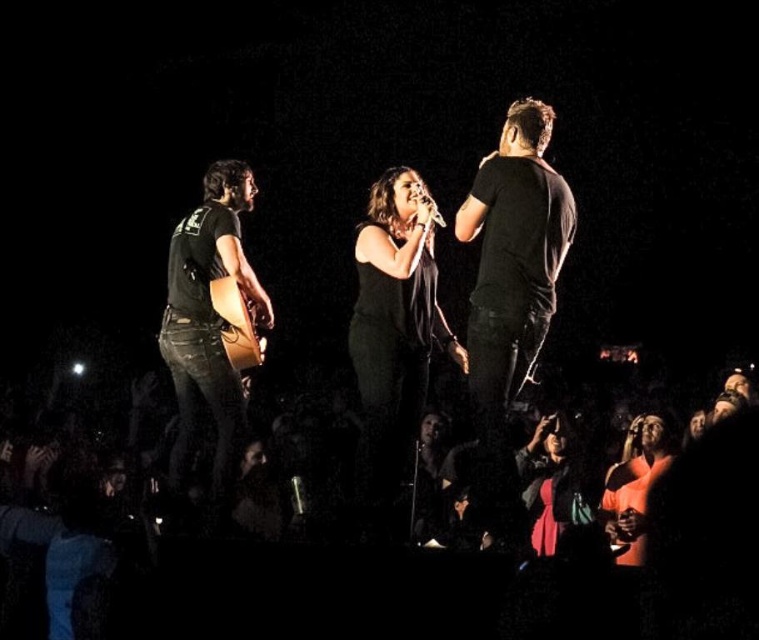
Question: Where is black matte dress at center located in relation to black leather guitar at left in the image?

Choices:
 (A) left
 (B) right

Answer: (B)

Question: Can you confirm if black matte dress at center is positioned to the left of metallic silver microphone at center?

Choices:
 (A) yes
 (B) no

Answer: (A)

Question: Which object appears farthest from the camera in this image?

Choices:
 (A) black matte shirt at center
 (B) brown wooden guitar at center

Answer: (B)

Question: Among these points, which one is nearest to the camera?

Choices:
 (A) (717, 454)
 (B) (424, 192)
 (C) (534, 484)
 (D) (367, 300)

Answer: (A)

Question: Can you confirm if black matte dress at center is wider than brown wooden guitar at center?

Choices:
 (A) no
 (B) yes

Answer: (B)

Question: Based on their relative distances, which object is farther from the black leather guitar at left?

Choices:
 (A) black matte dress at center
 (B) black matte shirt at center
 (C) metallic silver microphone at center
 (D) velvet red dress at lower right

Answer: (D)